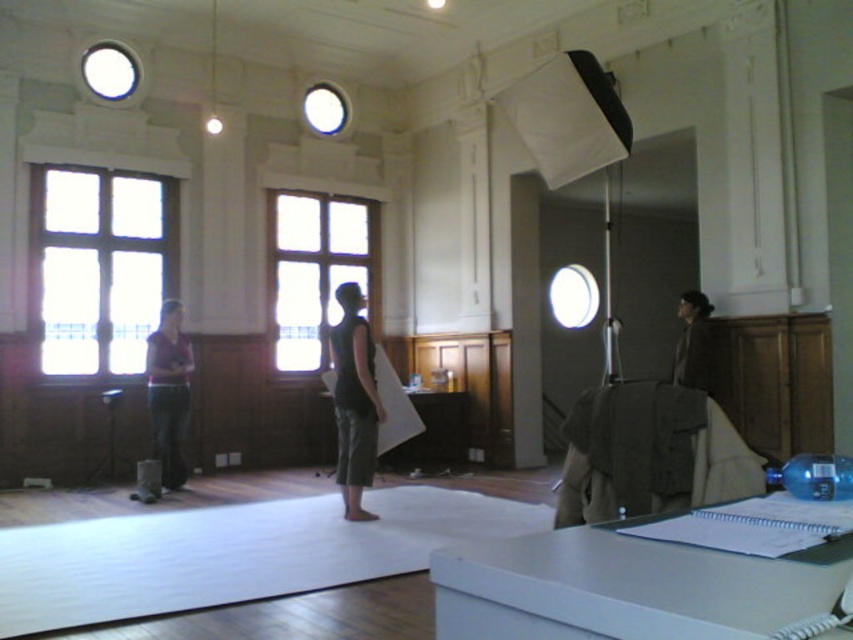
You are a photographer setting up a shoot in this room. You want to ensure the black matte tank top at center is well lit. The clear glass window at center is your only natural light source. Considering their distance apart, is the window close enough to adequately light the tank top?

The clear glass window at center is 11.47 feet away from the black matte tank top at center. At this distance, natural light from the window may still reach the tank top, but its intensity could be reduced depending on the window size and ambient conditions. However, 11.47 feet is a moderate distance, so the window should provide sufficient illumination for the black matte tank top at center if the lighting is properly angled and there are no obstructions.

Looking at this image, based on the scene description, where is the clear glass window at left located in the image?

The clear glass window at left is located at point (100, 266) in the image.